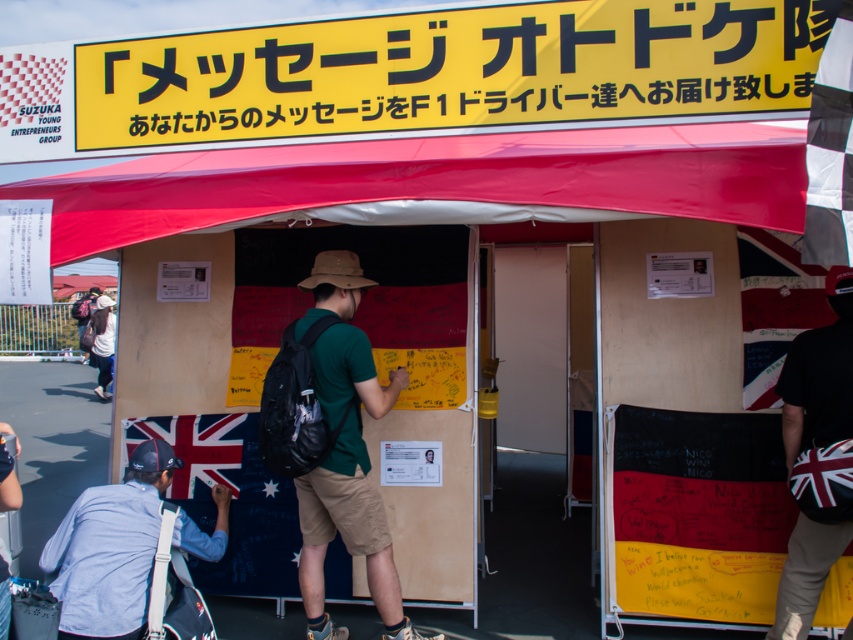
You are an event volunteer standing at the edge of the tent. You need to hand out a form to the person wearing the green matte shirt at center. The form is on the wooden bulletin board at center. Can you reach the form without moving closer to the shirt?

The distance between the wooden bulletin board at center and the green matte shirt at center is 24.49 inches. Since the volunteer is already at the edge of the tent, they can likely reach the form on the wooden bulletin board at center without needing to move closer to the green matte shirt at center, as 24.49 inches is within a comfortable reaching distance.